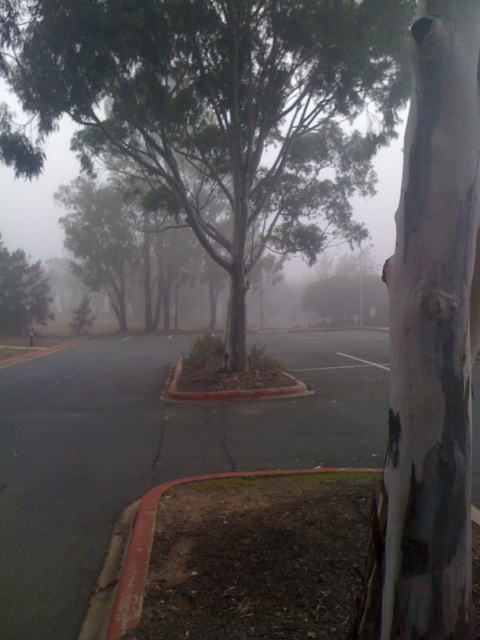
You are standing in the foggy outdoor scene and want to walk from the point closer to you to the point further away. Which path would you take between the two points, point (400, 518) and point (35, 301)?

The path from point (400, 518) to point (35, 301) would involve moving away from the camera since point (400, 518) is closer to you than point (35, 301).

You are standing at the center of the paved area and want to walk towards the green rough bark tree at center. Which direction should you head?

The green rough bark tree at center is located at point [216,109], so you should head towards the coordinates [216,109] to reach it.